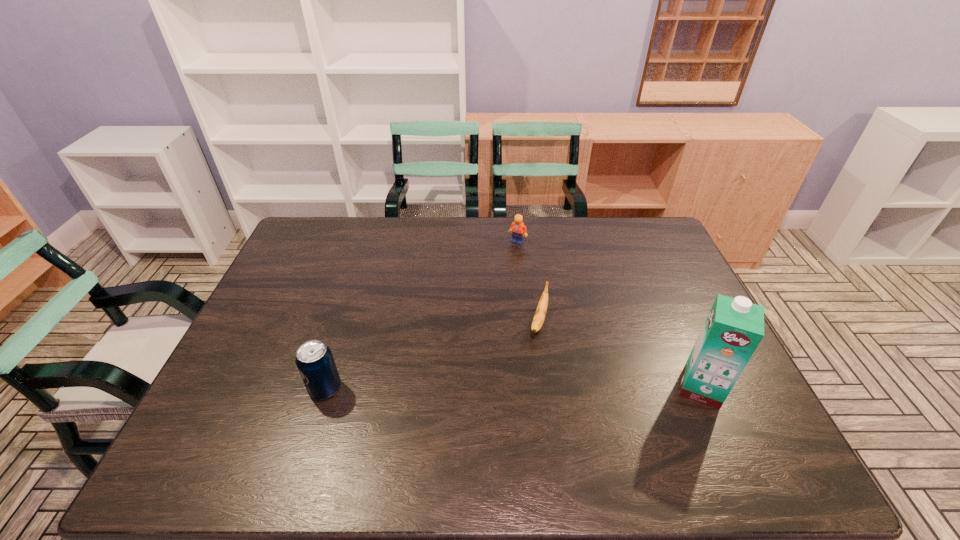
You are a GUI agent. You are given a task and a screenshot of the screen. Output one action in this format:
    pyautogui.click(x=<x>, y=<y>)
    Task: Click on the free space that is in between the third shortest object and the banana
    The image size is (960, 540).
    Given the screenshot: What is the action you would take?
    pyautogui.click(x=432, y=355)

This screenshot has width=960, height=540. I want to click on vacant space in between the tallest object and the second farthest object, so click(620, 354).

In order to click on vacant region between the rightmost object and the second farthest object in this screenshot , I will do `click(620, 354)`.

This screenshot has width=960, height=540. I want to click on free space between the banana and the Lego, so click(528, 281).

Where is `vacant space in between the banana and the farthest object`? Image resolution: width=960 pixels, height=540 pixels. vacant space in between the banana and the farthest object is located at coordinates (528, 281).

Image resolution: width=960 pixels, height=540 pixels. Identify the location of vacant space that's between the Lego and the third nearest object. (528, 281).

Image resolution: width=960 pixels, height=540 pixels. I want to click on vacant space that is in between the carton and the banana, so click(620, 354).

Identify which object is the closest to the Lego. Please provide its 2D coordinates. Your answer should be formatted as a tuple, i.e. [(x, y)], where the tuple contains the x and y coordinates of a point satisfying the conditions above.

[(539, 317)]

Locate an element on the screen. object that is the nearest to the shortest object is located at coordinates (518, 229).

Identify the location of free spot that satisfies the following two spatial constraints: 1. on the front side of the tallest object; 2. on the right side of the shortest object. The image size is (960, 540). (548, 388).